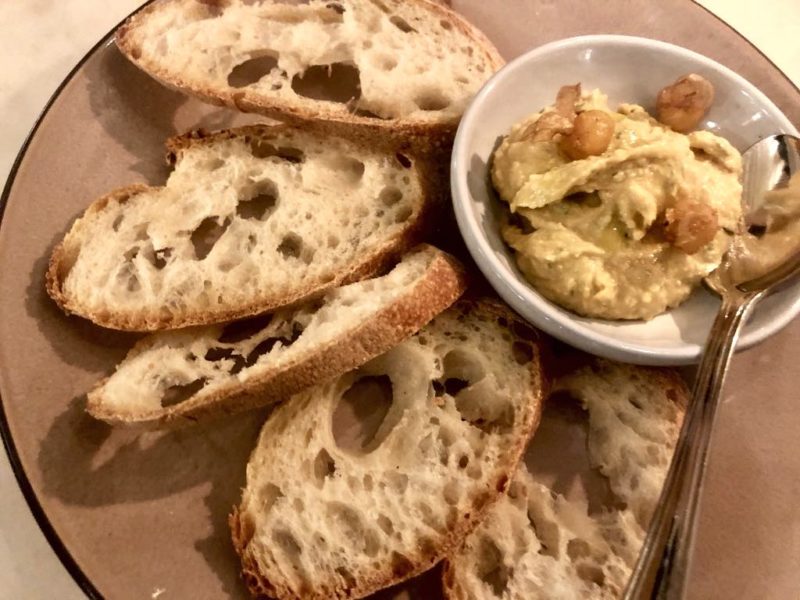
Locate an element on the screen. The height and width of the screenshot is (600, 800). plate is located at coordinates (185, 476).